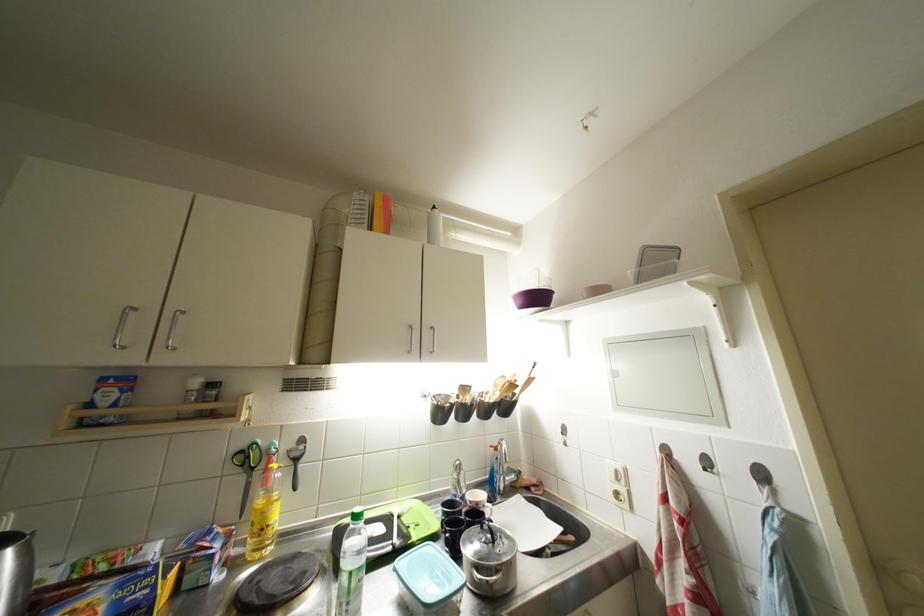
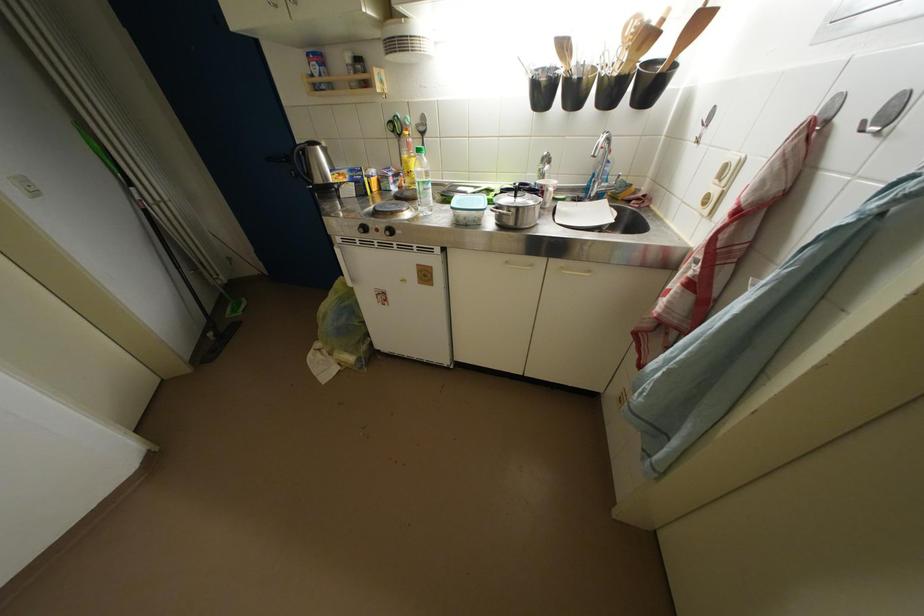
Where in the second image is the point corresponding to [505,398] from the first image?

(631, 60)